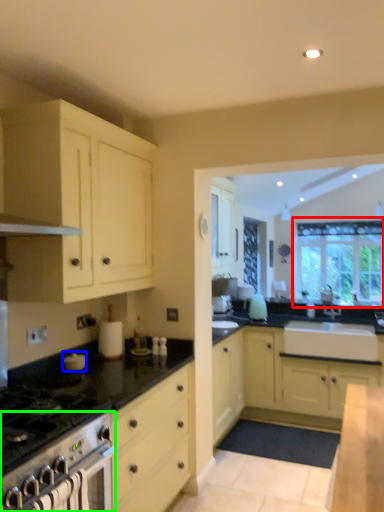
Question: Based on their relative distances, which object is farther from window (highlighted by a red box)? Choose from appliance (highlighted by a blue box) and oven (highlighted by a green box).

Choices:
 (A) appliance
 (B) oven

Answer: (B)